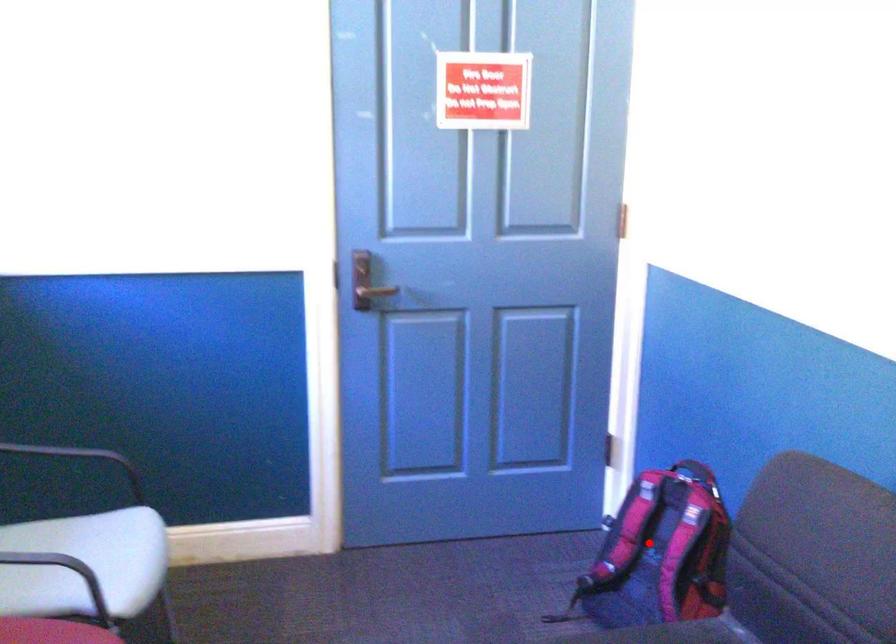
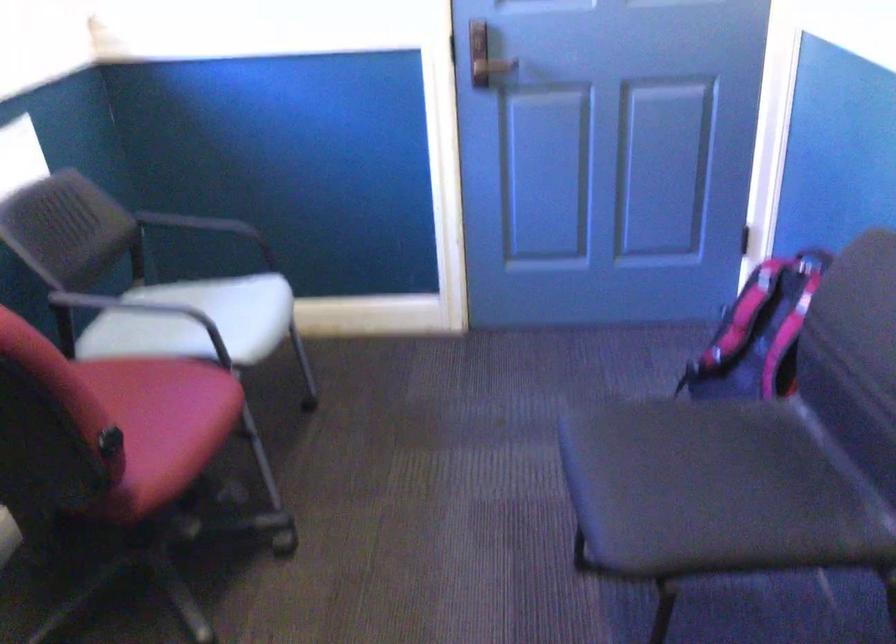
Where in the second image is the point corresponding to the highlighted location from the first image?

(759, 333)